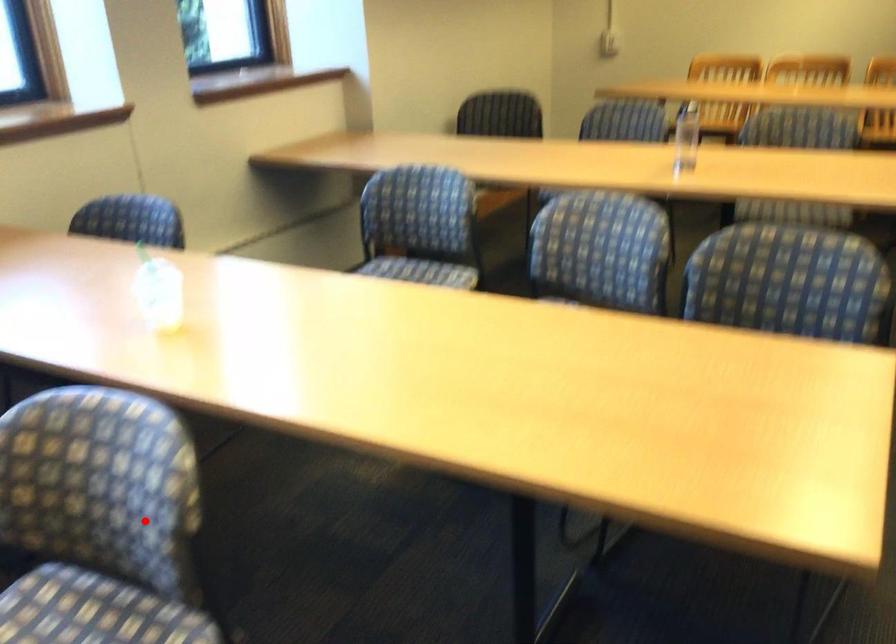
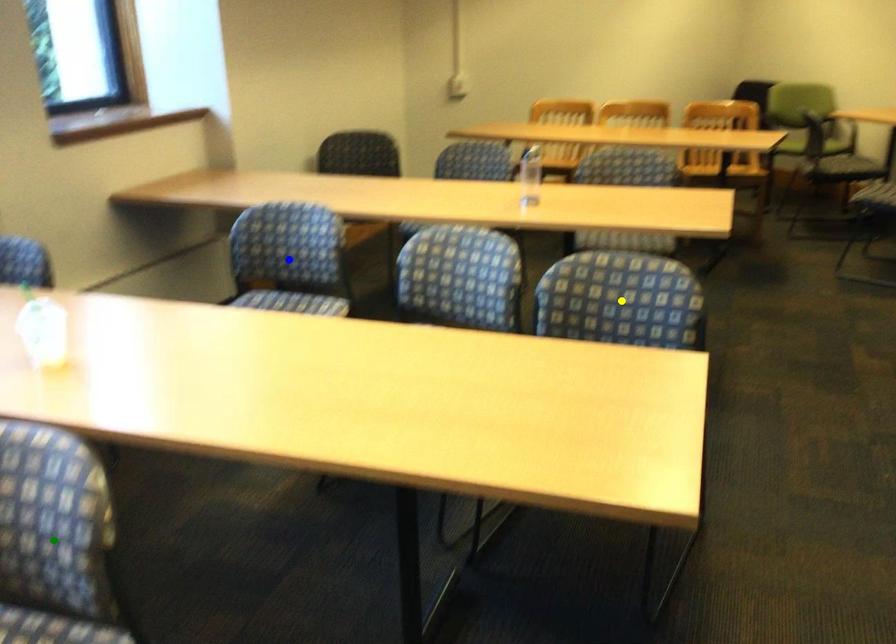
Question: I am providing you with two images of the same scene from different viewpoints. A red point is marked on the first image. You are given multiple points on the second image. Which mark in image 2 goes with the point in image 1?

Choices:
 (A) green point
 (B) blue point
 (C) yellow point

Answer: (A)